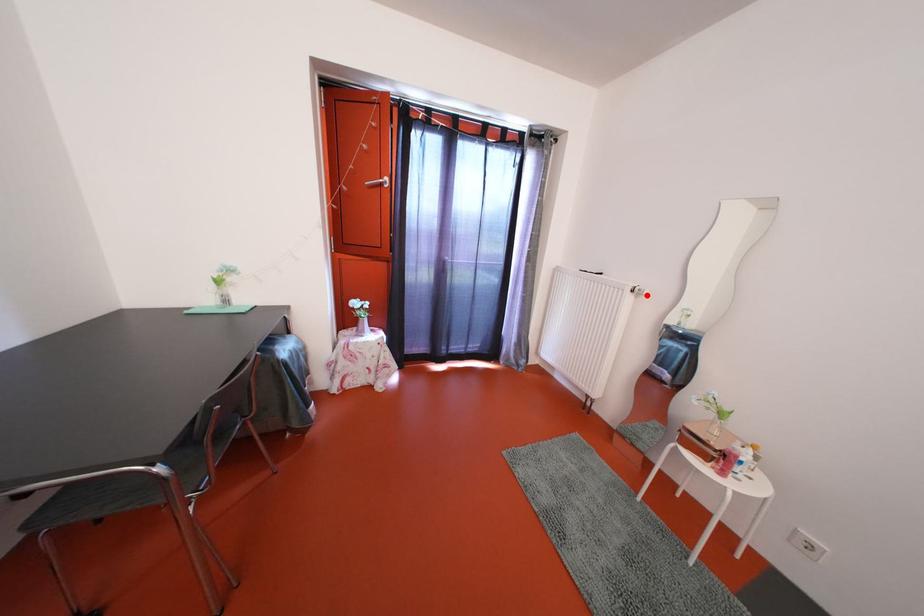
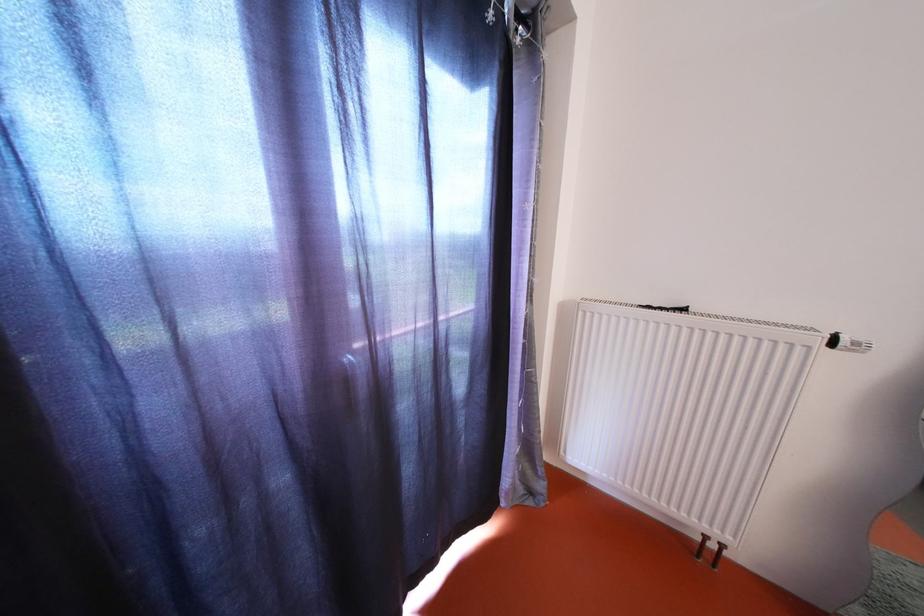
Locate, in the second image, the point that corresponds to the highlighted location in the first image.

(862, 349)